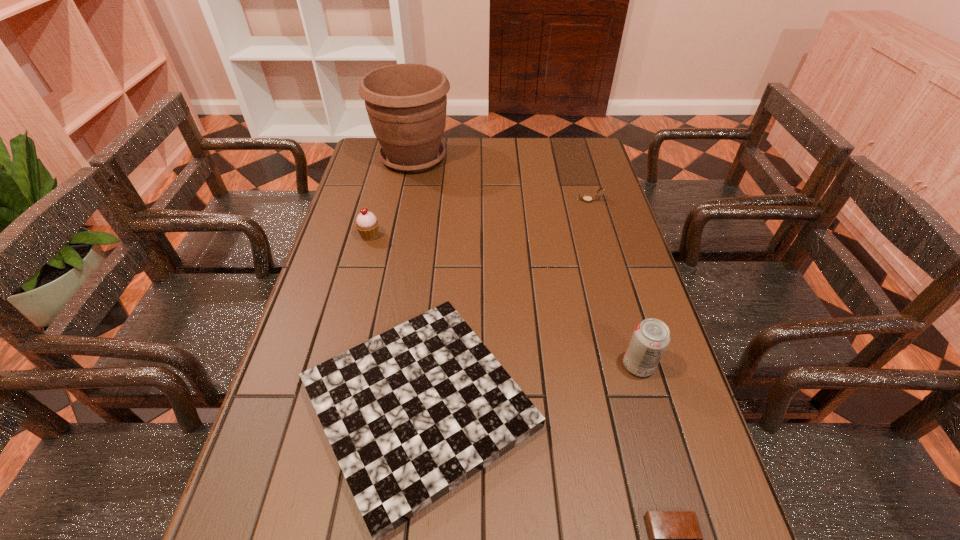
Find the location of a particular element. This screenshot has width=960, height=540. vacant space located 0.390m on the face of the third shortest object is located at coordinates (459, 200).

You are a GUI agent. You are given a task and a screenshot of the screen. Output one action in this format:
    pyautogui.click(x=<x>, y=<y>)
    Task: Click on the vacant space located on the face of the third shortest object
    The width and height of the screenshot is (960, 540).
    Given the screenshot: What is the action you would take?
    pyautogui.click(x=489, y=200)

This screenshot has width=960, height=540. I want to click on free region located 0.260m on the face of the third shortest object, so click(x=498, y=200).

The height and width of the screenshot is (540, 960). I want to click on object present at the far edge, so click(406, 103).

Locate an element on the screen. The image size is (960, 540). flowerpot that is at the left edge is located at coordinates (406, 103).

This screenshot has width=960, height=540. Find the location of `cupcake that is positioned at the left edge`. cupcake that is positioned at the left edge is located at coordinates (367, 224).

Identify the location of soda can situated at the right edge. (651, 337).

I want to click on compass situated at the right edge, so click(586, 198).

Where is `object that is at the far left corner`? object that is at the far left corner is located at coordinates (406, 103).

Where is `vacant area at the far edge of the desktop`? The image size is (960, 540). vacant area at the far edge of the desktop is located at coordinates point(493,158).